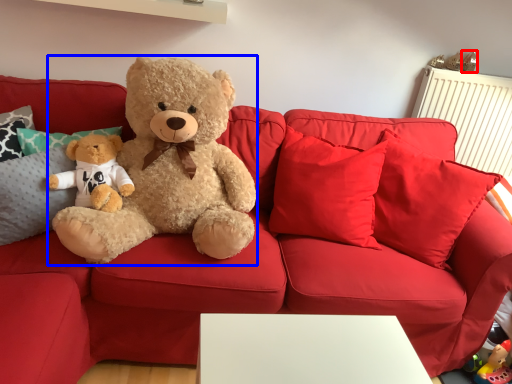
Question: Which object is further to the camera taking this photo, toy (highlighted by a red box) or teddy bear (highlighted by a blue box)?

Choices:
 (A) toy
 (B) teddy bear

Answer: (A)